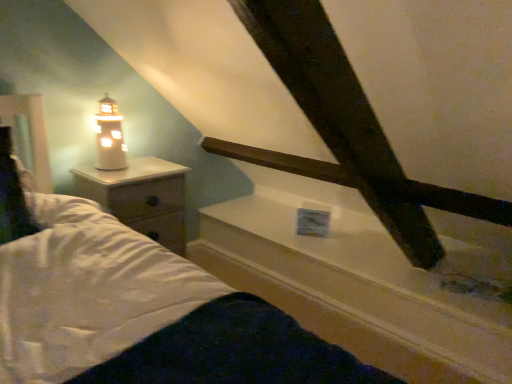
Question: Can you confirm if white ceramic lighthouse at left is bigger than white glossy window sill at upper center?

Choices:
 (A) no
 (B) yes

Answer: (A)

Question: From the image's perspective, is white ceramic lighthouse at left beneath white glossy window sill at upper center?

Choices:
 (A) yes
 (B) no

Answer: (B)

Question: Is white ceramic lighthouse at left at the right side of white glossy window sill at upper center?

Choices:
 (A) no
 (B) yes

Answer: (A)

Question: From a real-world perspective, is white ceramic lighthouse at left located beneath white glossy window sill at upper center?

Choices:
 (A) no
 (B) yes

Answer: (A)

Question: Considering the relative sizes of white ceramic lighthouse at left and white glossy window sill at upper center in the image provided, is white ceramic lighthouse at left smaller than white glossy window sill at upper center?

Choices:
 (A) no
 (B) yes

Answer: (B)

Question: From the image's perspective, relative to white ceramic lighthouse at left, is white wood nightstand at left above or below?

Choices:
 (A) above
 (B) below

Answer: (B)

Question: Is white wood nightstand at left to the left or to the right of white ceramic lighthouse at left in the image?

Choices:
 (A) right
 (B) left

Answer: (A)

Question: Does point (137, 223) appear closer or farther from the camera than point (117, 114)?

Choices:
 (A) closer
 (B) farther

Answer: (A)

Question: From a real-world perspective, is white wood nightstand at left above or below white ceramic lighthouse at left?

Choices:
 (A) below
 (B) above

Answer: (A)

Question: Considering the positions of white glossy window sill at upper center and white ceramic lighthouse at left in the image, is white glossy window sill at upper center taller or shorter than white ceramic lighthouse at left?

Choices:
 (A) tall
 (B) short

Answer: (B)

Question: From the image's perspective, is white glossy window sill at upper center above or below white ceramic lighthouse at left?

Choices:
 (A) above
 (B) below

Answer: (B)

Question: Choose the correct answer: Is white glossy window sill at upper center inside white ceramic lighthouse at left or outside it?

Choices:
 (A) inside
 (B) outside

Answer: (B)

Question: From a real-world perspective, is white glossy window sill at upper center above or below white ceramic lighthouse at left?

Choices:
 (A) below
 (B) above

Answer: (A)

Question: Is white ceramic lighthouse at left inside the boundaries of white wood nightstand at left, or outside?

Choices:
 (A) inside
 (B) outside

Answer: (B)

Question: In the image, is white ceramic lighthouse at left positioned in front of or behind white wood nightstand at left?

Choices:
 (A) behind
 (B) front

Answer: (A)